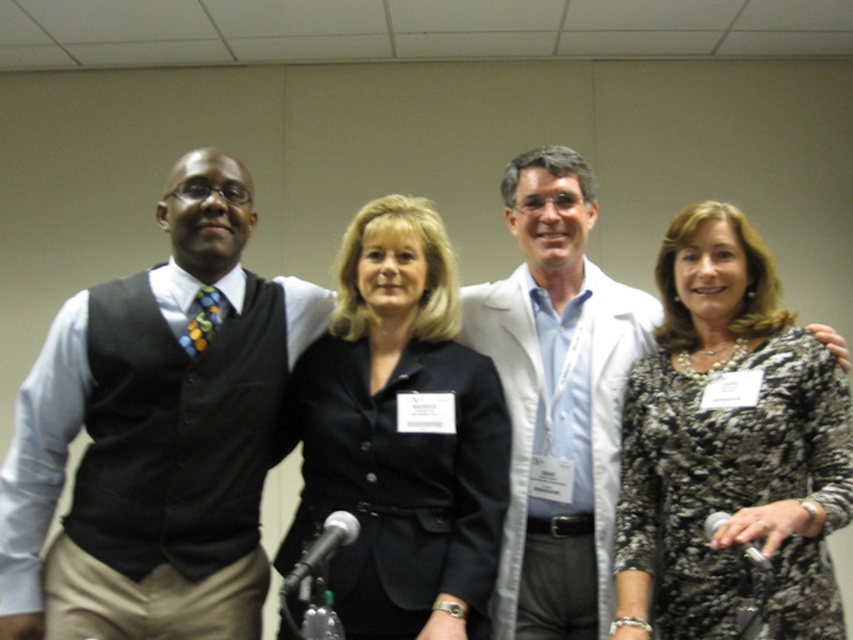
Who is more distant from viewer, [189,250] or [550,333]?

The point [550,333] is behind.

Does matte black vest at left appear over white lab coat at center?

Correct, matte black vest at left is located above white lab coat at center.

Is point (86, 365) positioned after point (477, 333)?

No, (86, 365) is closer to viewer.

Where is `matte black vest at left`? This screenshot has height=640, width=853. matte black vest at left is located at coordinates (157, 424).

Which of these two, matte black vest at left or black smooth blazer at center, stands taller?

Standing taller between the two is matte black vest at left.

This screenshot has width=853, height=640. What are the coordinates of `matte black vest at left` in the screenshot? It's located at (157, 424).

Where is `matte black vest at left`? matte black vest at left is located at coordinates pyautogui.click(x=157, y=424).

Looking at this image, is black textured dress at center thinner than black smooth blazer at center?

Correct, black textured dress at center's width is less than black smooth blazer at center's.

Based on the photo, which is more to the right, black textured dress at center or black smooth blazer at center?

black textured dress at center is more to the right.

The width and height of the screenshot is (853, 640). What do you see at coordinates (729, 448) in the screenshot?
I see `black textured dress at center` at bounding box center [729, 448].

Locate an element on the screen. The width and height of the screenshot is (853, 640). black textured dress at center is located at coordinates (729, 448).